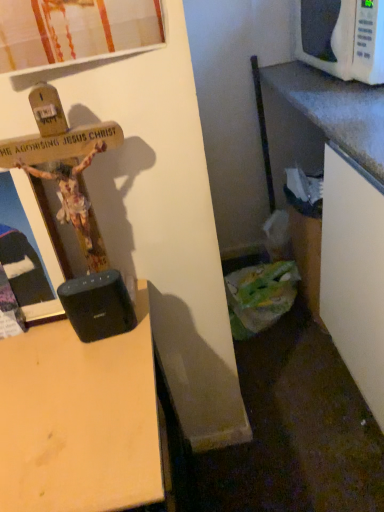
The height and width of the screenshot is (512, 384). What do you see at coordinates (79, 419) in the screenshot?
I see `wooden desk at center` at bounding box center [79, 419].

You are a GUI agent. You are given a task and a screenshot of the screen. Output one action in this format:
    pyautogui.click(x=<x>, y=<y>)
    Task: Click on the wooden desk at center
    
    Given the screenshot: What is the action you would take?
    pyautogui.click(x=79, y=419)

Find the location of a particular element. The image size is (384, 512). white plastic microwave at upper right is located at coordinates (343, 38).

The height and width of the screenshot is (512, 384). Describe the element at coordinates (343, 38) in the screenshot. I see `white plastic microwave at upper right` at that location.

You are a GUI agent. You are given a task and a screenshot of the screen. Output one action in this format:
    pyautogui.click(x=<x>, y=<y>)
    Task: Click on the wooden desk at center
    The image size is (384, 512).
    Given the screenshot: What is the action you would take?
    pyautogui.click(x=79, y=419)

Which object is positioned more to the right, wooden desk at center or white plastic microwave at upper right?

Positioned to the right is white plastic microwave at upper right.

Which is in front, wooden desk at center or white plastic microwave at upper right?

wooden desk at center is closer to the camera.

Between point (78, 364) and point (332, 26), which one is positioned in front?

The point (78, 364) is more forward.

From the image's perspective, relative to white plastic microwave at upper right, is wooden desk at center above or below?

wooden desk at center is below white plastic microwave at upper right.

From a real-world perspective, which is physically above, wooden desk at center or white plastic microwave at upper right?

white plastic microwave at upper right.

Considering the relative sizes of wooden desk at center and white plastic microwave at upper right in the image provided, is wooden desk at center thinner than white plastic microwave at upper right?

No, wooden desk at center is not thinner than white plastic microwave at upper right.

Is wooden desk at center taller than white plastic microwave at upper right?

Yes.

Does wooden desk at center have a larger size compared to white plastic microwave at upper right?

Yes.

Would you say wooden desk at center is outside white plastic microwave at upper right?

Yes, wooden desk at center is not within white plastic microwave at upper right.

Can you see wooden desk at center touching white plastic microwave at upper right?

wooden desk at center and white plastic microwave at upper right are clearly separated.

Is wooden desk at center oriented towards white plastic microwave at upper right?

No, wooden desk at center does not turn towards white plastic microwave at upper right.

In the scene shown: How distant is wooden desk at center from white plastic microwave at upper right?

wooden desk at center is 1.16 meters from white plastic microwave at upper right.

Locate an element on the screen. This screenshot has width=384, height=512. microwave oven behind the wooden desk at center is located at coordinates point(343,38).

Which object is positioned more to the right, white plastic microwave at upper right or wooden desk at center?

white plastic microwave at upper right is more to the right.

Does white plastic microwave at upper right come behind wooden desk at center?

Yes, it is behind wooden desk at center.

Is point (333, 29) closer or farther from the camera than point (94, 453)?

Point (333, 29).

From the image's perspective, is white plastic microwave at upper right on wooden desk at center?

Indeed, from the image's perspective, white plastic microwave at upper right is shown above wooden desk at center.

From a real-world perspective, is white plastic microwave at upper right above or below wooden desk at center?

white plastic microwave at upper right is situated higher than wooden desk at center in the real world.

Is white plastic microwave at upper right thinner than wooden desk at center?

Yes, white plastic microwave at upper right is thinner than wooden desk at center.

Does white plastic microwave at upper right have a lesser height compared to wooden desk at center?

Yes.

Does white plastic microwave at upper right have a larger size compared to wooden desk at center?

No.

Is white plastic microwave at upper right located outside wooden desk at center?

Yes, white plastic microwave at upper right is not within wooden desk at center.

From the picture: Would you consider white plastic microwave at upper right to be distant from wooden desk at center?

white plastic microwave at upper right is far away from wooden desk at center.

Is white plastic microwave at upper right positioned with its back to wooden desk at center?

No.

What's the angular difference between white plastic microwave at upper right and wooden desk at center's facing directions?

white plastic microwave at upper right and wooden desk at center are facing 81.3 degrees away from each other.

How distant is white plastic microwave at upper right from wooden desk at center?

The distance of white plastic microwave at upper right from wooden desk at center is 3.82 feet.

Image resolution: width=384 pixels, height=512 pixels. What are the coordinates of `microwave oven lying on the right of wooden desk at center` in the screenshot? It's located at (343, 38).

What are the coordinates of `desk below the white plastic microwave at upper right (from a real-world perspective)` in the screenshot? It's located at (79, 419).

At what (x,y) coordinates should I click in order to perform the action: click on desk below the white plastic microwave at upper right (from the image's perspective). Please return your answer as a coordinate pair (x, y). Looking at the image, I should click on (79, 419).